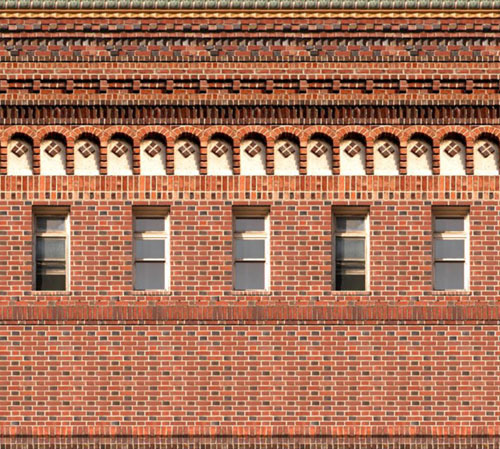
Locate an element on the screen. The width and height of the screenshot is (500, 449). second window from left is located at coordinates (145, 247).